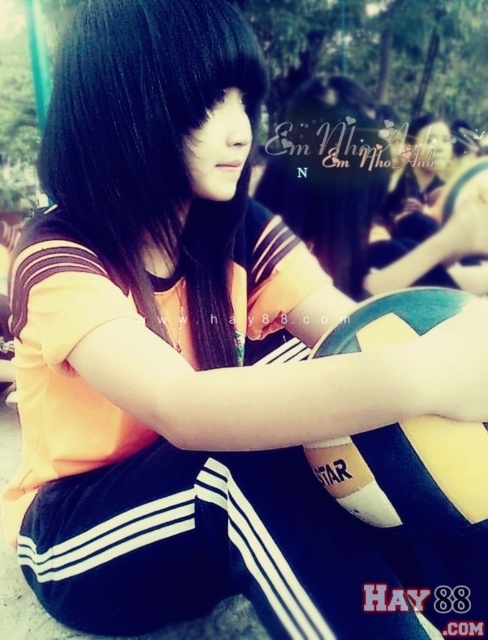
Can you confirm if black glossy hair at center is shorter than blue rubber beach ball at center?

No, black glossy hair at center is not shorter than blue rubber beach ball at center.

Who is positioned more to the right, black glossy hair at center or blue rubber beach ball at center?

blue rubber beach ball at center is more to the right.

Identify the location of black glossy hair at center. This screenshot has height=640, width=488. (150, 148).